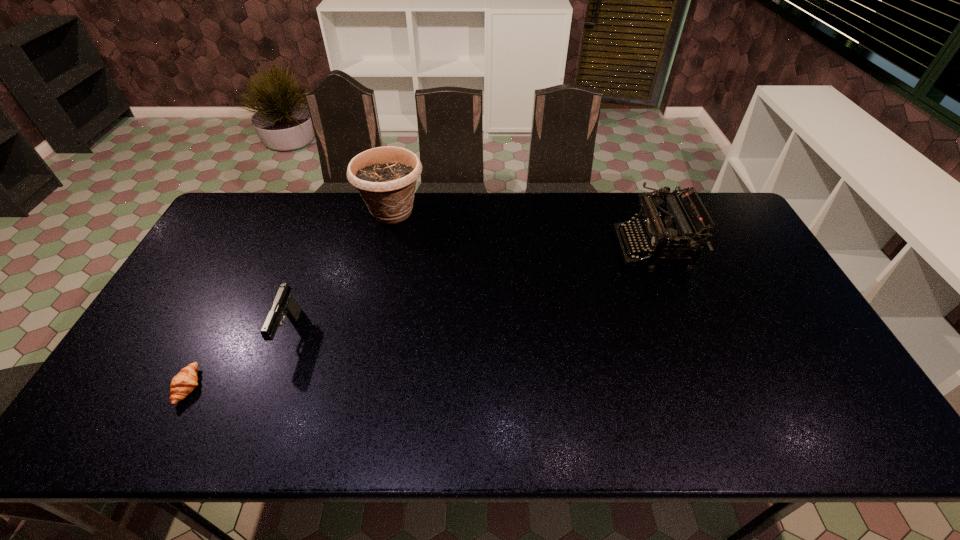
In the image, there is a desktop. At what (x,y) coordinates should I click in order to perform the action: click on free region at the far left corner. Please return your answer as a coordinate pair (x, y). The height and width of the screenshot is (540, 960). Looking at the image, I should click on coord(252,214).

Locate an element on the screen. The width and height of the screenshot is (960, 540). free region at the near right corner of the desktop is located at coordinates (827, 424).

Where is `vacant space that's between the flowerpot and the rightmost object`? The height and width of the screenshot is (540, 960). vacant space that's between the flowerpot and the rightmost object is located at coordinates (522, 230).

Where is `free space between the second object from right to left and the pistol`? free space between the second object from right to left and the pistol is located at coordinates (341, 273).

Where is `vacant region between the shortest object and the pistol`? The image size is (960, 540). vacant region between the shortest object and the pistol is located at coordinates (239, 360).

Locate an element on the screen. The width and height of the screenshot is (960, 540). empty space that is in between the third object from left to right and the rightmost object is located at coordinates (522, 230).

Where is `vacant space that's between the rightmost object and the third object from right to left`? This screenshot has height=540, width=960. vacant space that's between the rightmost object and the third object from right to left is located at coordinates (471, 291).

Identify the location of unoccupied position between the third object from right to left and the third object from left to right. The height and width of the screenshot is (540, 960). (341, 273).

At what (x,y) coordinates should I click in order to perform the action: click on free space between the second object from right to left and the pistol. Please return your answer as a coordinate pair (x, y). Looking at the image, I should click on (341, 273).

Where is `vacant area that lies between the third object from left to right and the rightmost object`? Image resolution: width=960 pixels, height=540 pixels. vacant area that lies between the third object from left to right and the rightmost object is located at coordinates (522, 230).